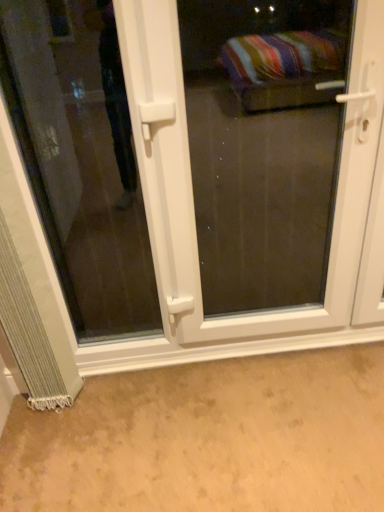
Question: Based on their positions, is transparent glass door at lower left located to the left or right of white plastic door at center?

Choices:
 (A) left
 (B) right

Answer: (A)

Question: Based on their sizes in the image, would you say transparent glass door at lower left is bigger or smaller than white plastic door at center?

Choices:
 (A) big
 (B) small

Answer: (B)

Question: Which object is positioned farthest from the silvery textured curtain at lower left?

Choices:
 (A) transparent glass door at lower left
 (B) white plastic door at center

Answer: (A)

Question: Which is farther from the silvery textured curtain at lower left?

Choices:
 (A) transparent glass door at lower left
 (B) white plastic door at center

Answer: (A)